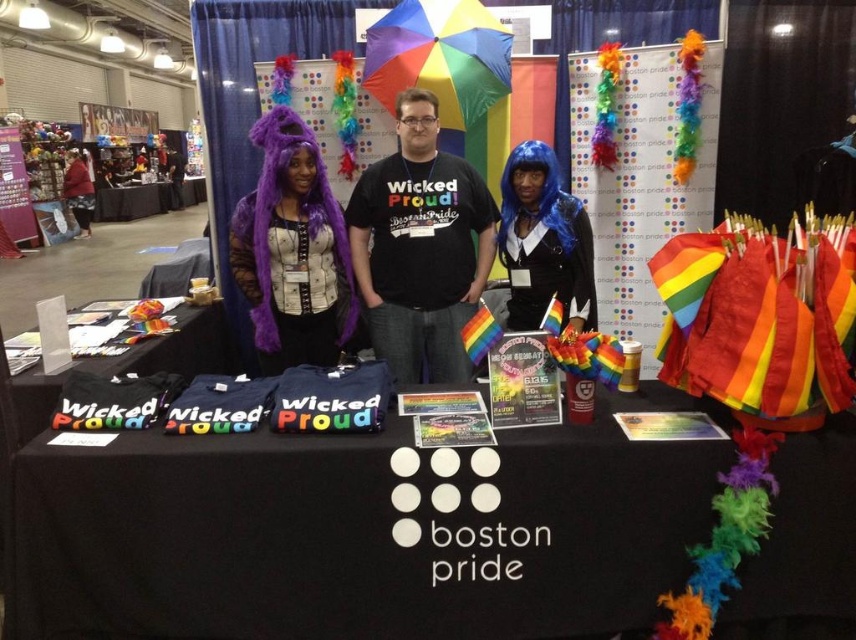
Question: Which of the following is the closest to the observer?

Choices:
 (A) [x=321, y=253]
 (B) [x=456, y=1]
 (C) [x=159, y=182]

Answer: (A)

Question: Is black t-shirt at center wider than rainbow fabric umbrella at upper center?

Choices:
 (A) yes
 (B) no

Answer: (B)

Question: Is rainbow fabric umbrella at upper center further to the viewer compared to black fabric table at left?

Choices:
 (A) yes
 (B) no

Answer: (B)

Question: Is black t-shirt at center positioned in front of blue matte wig at center?

Choices:
 (A) no
 (B) yes

Answer: (A)

Question: Which of the following is the farthest from the observer?

Choices:
 (A) (144, 189)
 (B) (443, 36)
 (C) (372, 195)
 (D) (388, 266)

Answer: (A)

Question: Which point is farther from the camera taking this photo?

Choices:
 (A) (450, 349)
 (B) (504, 86)
 (C) (205, 372)

Answer: (B)